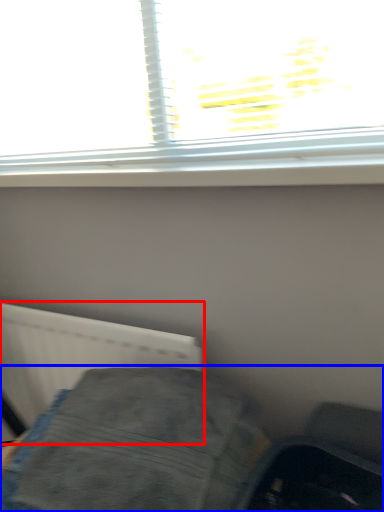
Question: Which object is closer to the camera taking this photo, radiator (highlighted by a red box) or furniture (highlighted by a blue box)?

Choices:
 (A) radiator
 (B) furniture

Answer: (B)